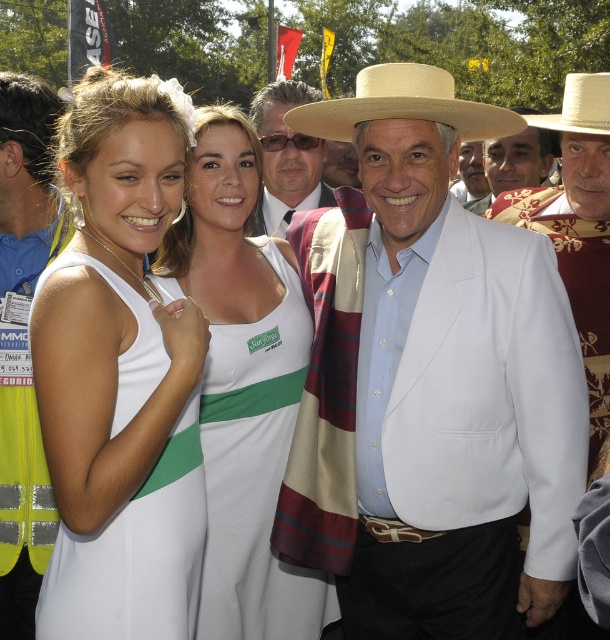
Question: Which point appears closest to the camera in this image?

Choices:
 (A) (514, 161)
 (B) (176, 250)

Answer: (B)

Question: Which object is closer to the camera taking this photo?

Choices:
 (A) natural straw hat at upper center
 (B) white cotton suit at center
 (C) white fabric dress at center

Answer: (C)

Question: Which of these objects is positioned farthest from the white cotton shirt at center?

Choices:
 (A) white matte blazer at center
 (B) white cotton hat at center
 (C) white cotton suit at center

Answer: (B)

Question: Can you confirm if white cotton shirt at center is smaller than white cotton hat at center?

Choices:
 (A) yes
 (B) no

Answer: (A)

Question: Observing the image, what is the correct spatial positioning of white fabric dress at center in reference to matte white hat at upper center?

Choices:
 (A) above
 (B) below

Answer: (B)

Question: Is white satin dress at center smaller than matte white hat at center?

Choices:
 (A) no
 (B) yes

Answer: (B)